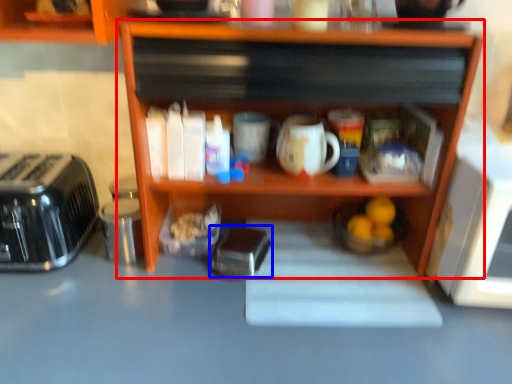
Question: Which of the following is the closest to the observer, shelf (highlighted by a red box) or appliance (highlighted by a blue box)?

Choices:
 (A) shelf
 (B) appliance

Answer: (A)